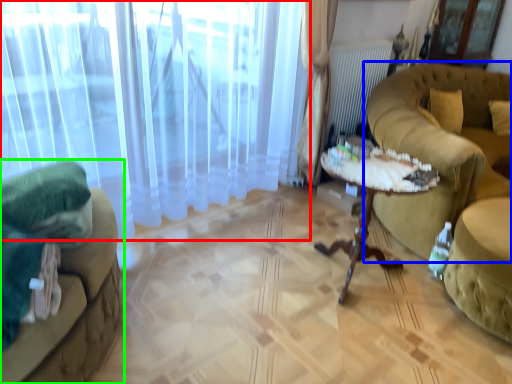
Question: Which object is positioned farthest from curtain (highlighted by a red box)? Select from studio couch (highlighted by a blue box) and studio couch (highlighted by a green box).

Choices:
 (A) studio couch
 (B) studio couch

Answer: (A)